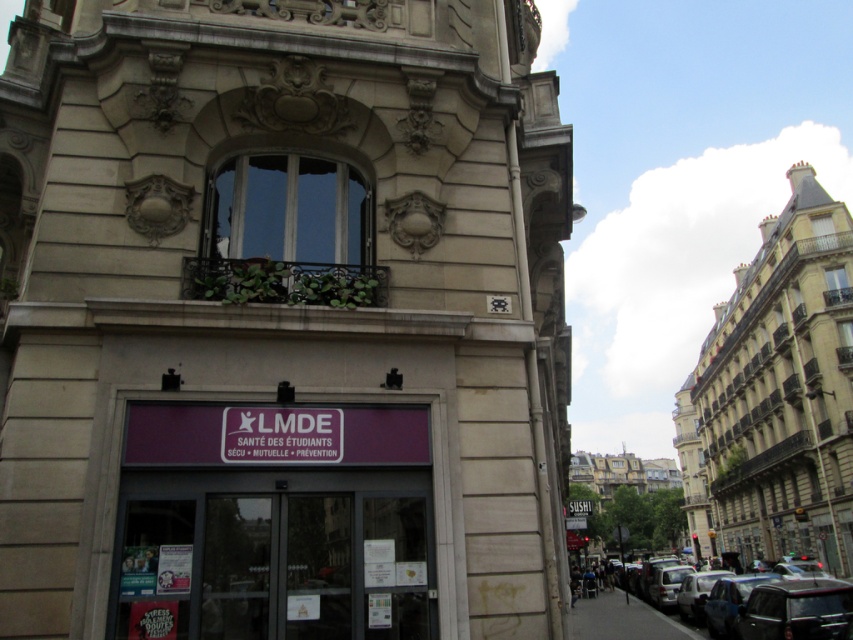
Is beige stone tower at center shorter than metallic silver car at lower right?

Correct, beige stone tower at center is not as tall as metallic silver car at lower right.

Is point (403, 268) more distant than point (692, 577)?

No, (403, 268) is in front of (692, 577).

What do you see at coordinates (281, 321) in the screenshot?
I see `beige stone tower at center` at bounding box center [281, 321].

You are a GUI agent. You are given a task and a screenshot of the screen. Output one action in this format:
    pyautogui.click(x=<x>, y=<y>)
    Task: Click on the beige stone tower at center
    The image size is (853, 640).
    Given the screenshot: What is the action you would take?
    pyautogui.click(x=281, y=321)